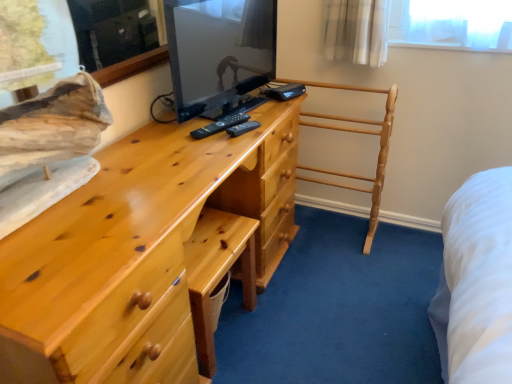
What are the coordinates of `vacant area that is situated to the right of black plastic remote at center` in the screenshot? It's located at (249, 123).